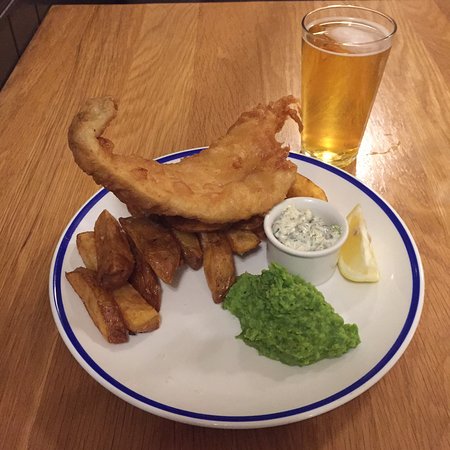
Find the location of `blue rim around plate`. blue rim around plate is located at coordinates (318, 403).